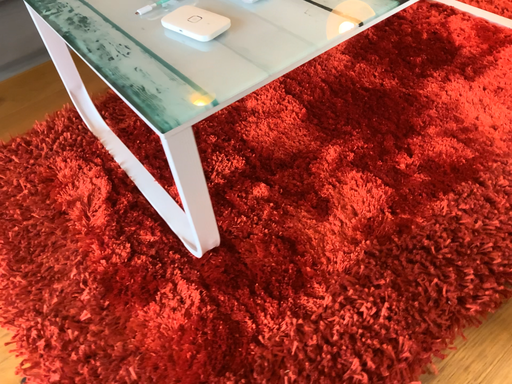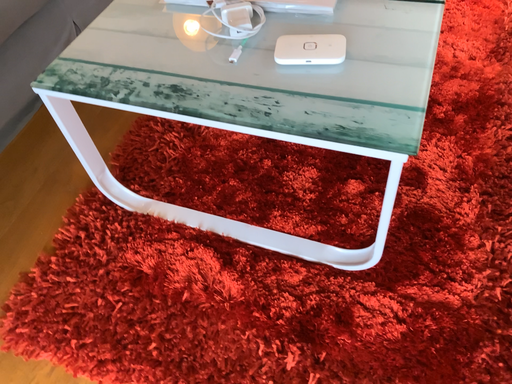
Question: How did the camera likely rotate when shooting the video?

Choices:
 (A) rotated left
 (B) rotated right

Answer: (B)